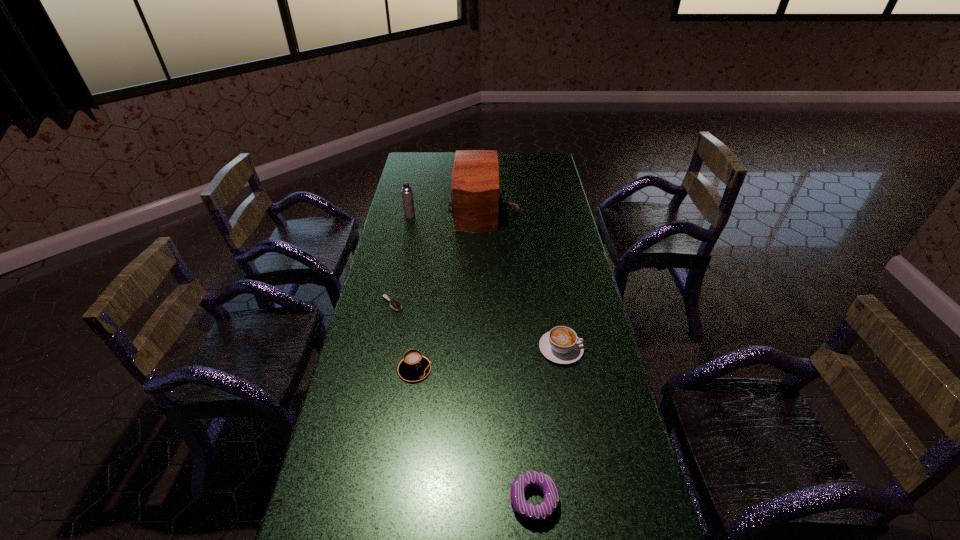
I want to click on vacant space located 0.100m on the front-facing side of the radio receiver, so click(x=428, y=208).

I want to click on blank space located 0.300m on the back of the second tallest object, so click(x=418, y=181).

I want to click on free spot located on the back of the third object from left to right, so click(422, 318).

Locate an element on the screen. This screenshot has width=960, height=540. free point located 0.070m on the side of the right cappuccino with the handle is located at coordinates (605, 349).

Identify the location of vacant space situated on the back of the nearest object. (525, 403).

At what (x,y) coordinates should I click in order to perform the action: click on vacant space located on the back of the shortest object. Please return your answer as a coordinate pair (x, y). This screenshot has height=540, width=960. Looking at the image, I should click on (396, 286).

Identify the location of thermos bottle that is at the left edge. The width and height of the screenshot is (960, 540). (407, 195).

You are a GUI agent. You are given a task and a screenshot of the screen. Output one action in this format:
    pyautogui.click(x=<x>, y=<y>)
    Task: Click on the cappuccino at the left edge
    The height and width of the screenshot is (540, 960).
    Given the screenshot: What is the action you would take?
    pyautogui.click(x=414, y=367)

The image size is (960, 540). I want to click on scrubbing brush located at the left edge, so coord(394,304).

You are a GUI agent. You are given a task and a screenshot of the screen. Output one action in this format:
    pyautogui.click(x=<x>, y=<y>)
    Task: Click on the object that is positioned at the right edge
    
    Given the screenshot: What is the action you would take?
    pyautogui.click(x=561, y=345)